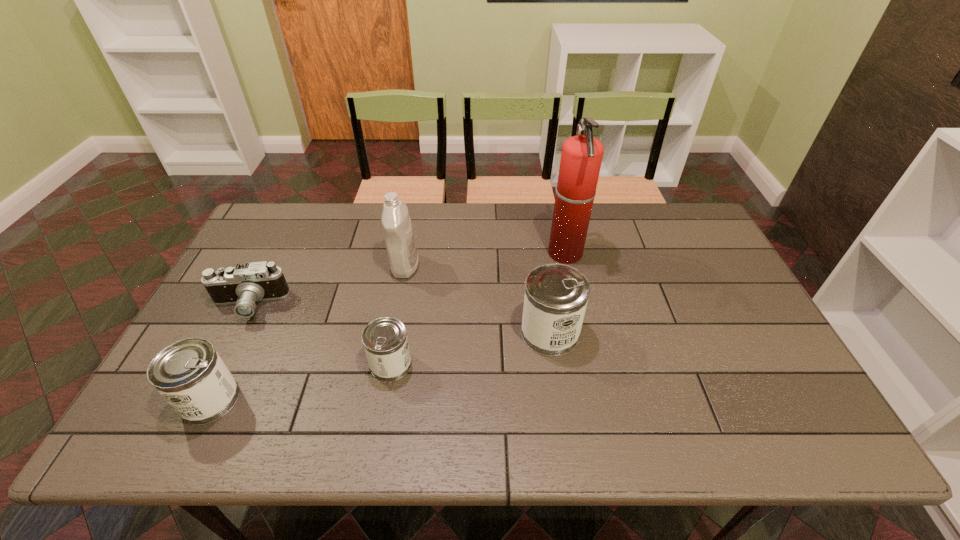
Please point a free position for a can on the right. Please provide its 2D coordinates. Your answer should be formatted as a tuple, i.e. [(x, y)], where the tuple contains the x and y coordinates of a point satisfying the conditions above.

[(690, 305)]